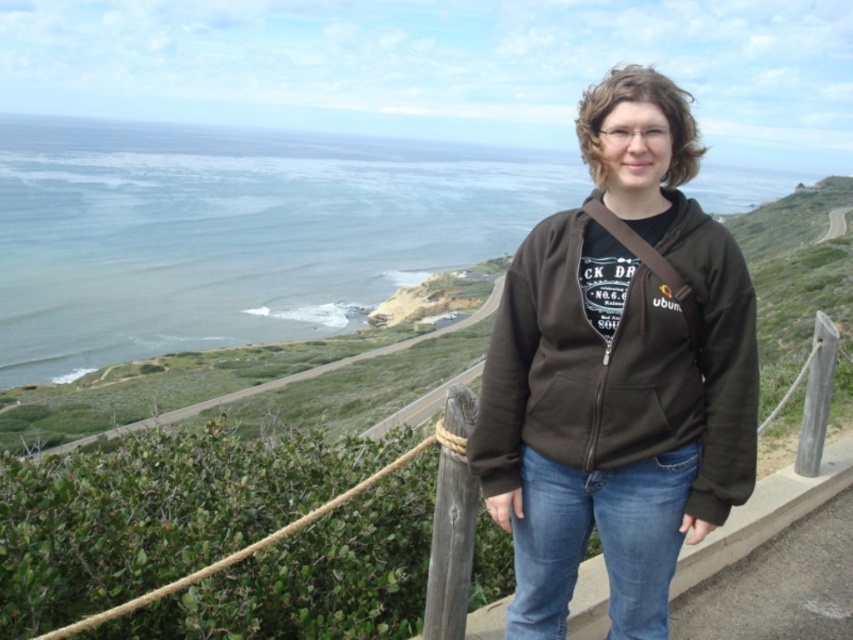
Question: Which object appears closest to the camera in this image?

Choices:
 (A) blue denim jeans at lower center
 (B) dark brown fleece sweatshirt at center

Answer: (B)

Question: Is dark brown fleece sweatshirt at center wider than blue denim jeans at lower center?

Choices:
 (A) no
 (B) yes

Answer: (B)

Question: Can you confirm if dark brown fleece sweatshirt at center is wider than blue denim jeans at lower center?

Choices:
 (A) yes
 (B) no

Answer: (A)

Question: Which object appears farthest from the camera in this image?

Choices:
 (A) dark brown fleece sweatshirt at center
 (B) blue denim jeans at lower center

Answer: (B)

Question: Among these points, which one is farthest from the camera?

Choices:
 (A) (590, 522)
 (B) (554, 452)

Answer: (A)

Question: Does dark brown fleece sweatshirt at center come in front of blue denim jeans at lower center?

Choices:
 (A) yes
 (B) no

Answer: (A)